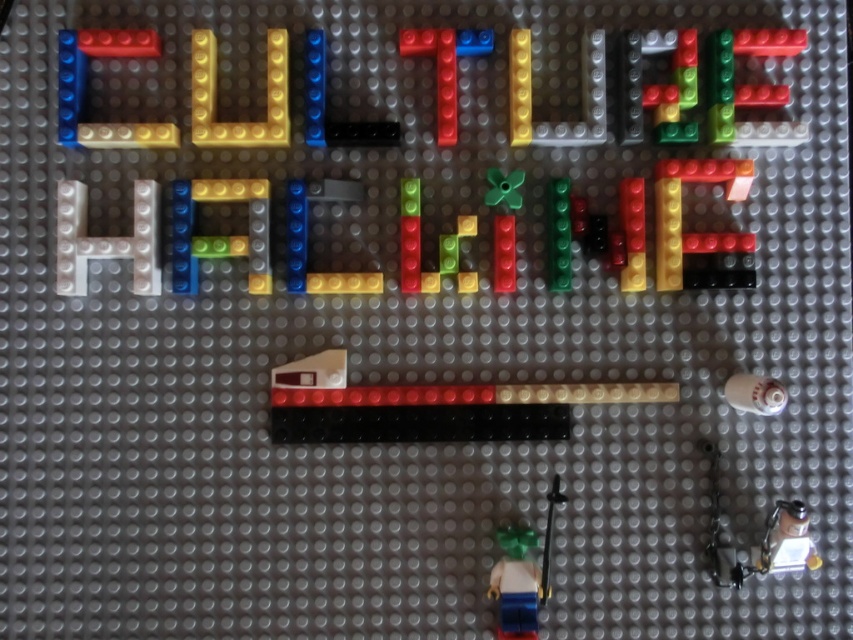
Between point (230, 250) and point (212, 93), which one is positioned in front?

Positioned in front is point (230, 250).

Does translucent yellow brick at center have a smaller size compared to yellow matte letter u at upper center?

Yes.

Does point (218, 243) lie behind point (206, 99)?

No, (218, 243) is in front of (206, 99).

At what (x,y) coordinates should I click in order to perform the action: click on translucent yellow brick at center. Please return your answer as a coordinate pair (x, y). Image resolution: width=853 pixels, height=640 pixels. Looking at the image, I should click on (218, 236).

Which is in front, point (287, 262) or point (467, 28)?

Point (287, 262) is more forward.

Can you confirm if translucent dark gray brick at center is taller than translucent blue plastic number seven at upper center?

In fact, translucent dark gray brick at center may be shorter than translucent blue plastic number seven at upper center.

Locate an element on the screen. Image resolution: width=853 pixels, height=640 pixels. translucent dark gray brick at center is located at coordinates (306, 237).

Based on the photo, does matte plastic bricks at upper left have a lesser width compared to smooth plastic minifigure at lower center?

No.

Measure the distance between point (67, 122) and camera.

1.25 meters

Locate an element on the screen. The width and height of the screenshot is (853, 640). matte plastic bricks at upper left is located at coordinates (85, 84).

Find the location of a particular element. The height and width of the screenshot is (640, 853). matte plastic bricks at upper left is located at coordinates (85, 84).